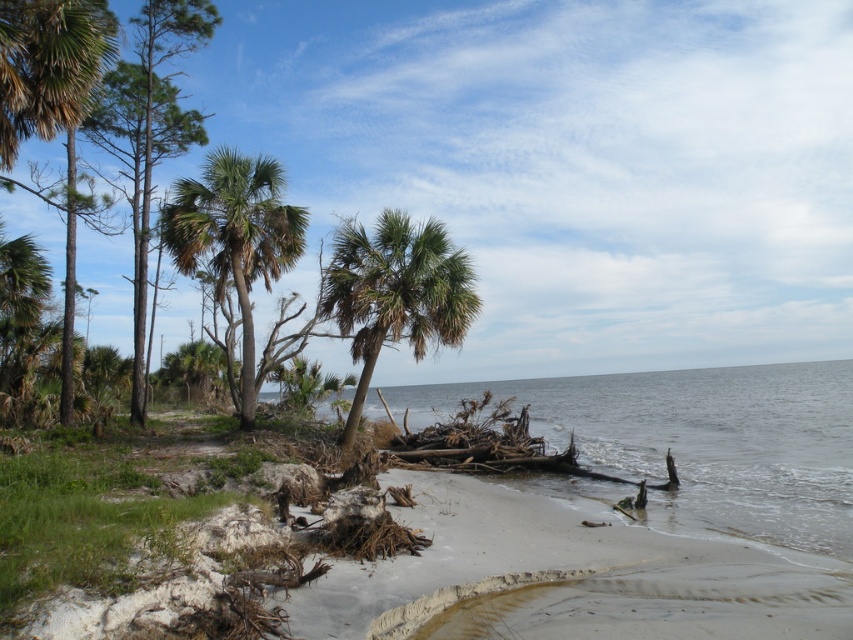
Can you confirm if green leafy palm tree at center-left is positioned to the right of green leafy palm tree at left?

Yes, green leafy palm tree at center-left is to the right of green leafy palm tree at left.

Based on the photo, is green leafy palm tree at center-left smaller than green leafy palm tree at left?

No.

Is point (173, 209) closer to viewer compared to point (45, 262)?

Yes, point (173, 209) is closer to viewer.

Where is `green leafy palm tree at center-left`? This screenshot has width=853, height=640. green leafy palm tree at center-left is located at coordinates (235, 237).

Does smooth sand beach at lower right appear on the right side of green leafy palm tree at center?

Indeed, smooth sand beach at lower right is positioned on the right side of green leafy palm tree at center.

Can you confirm if smooth sand beach at lower right is positioned to the left of green leafy palm tree at center?

Incorrect, smooth sand beach at lower right is not on the left side of green leafy palm tree at center.

Is point (401, 452) behind point (425, 337)?

Yes, it is.

What are the coordinates of `smooth sand beach at lower right` in the screenshot? It's located at (457, 577).

Is green leafy palm tree at center shorter than green leafy palm tree at center-left?

Indeed, green leafy palm tree at center has a lesser height compared to green leafy palm tree at center-left.

What do you see at coordinates (395, 292) in the screenshot? I see `green leafy palm tree at center` at bounding box center [395, 292].

Which is in front, point (379, 259) or point (259, 164)?

Point (379, 259) is in front.

Locate an element on the screen. The width and height of the screenshot is (853, 640). green leafy palm tree at center is located at coordinates coord(395,292).